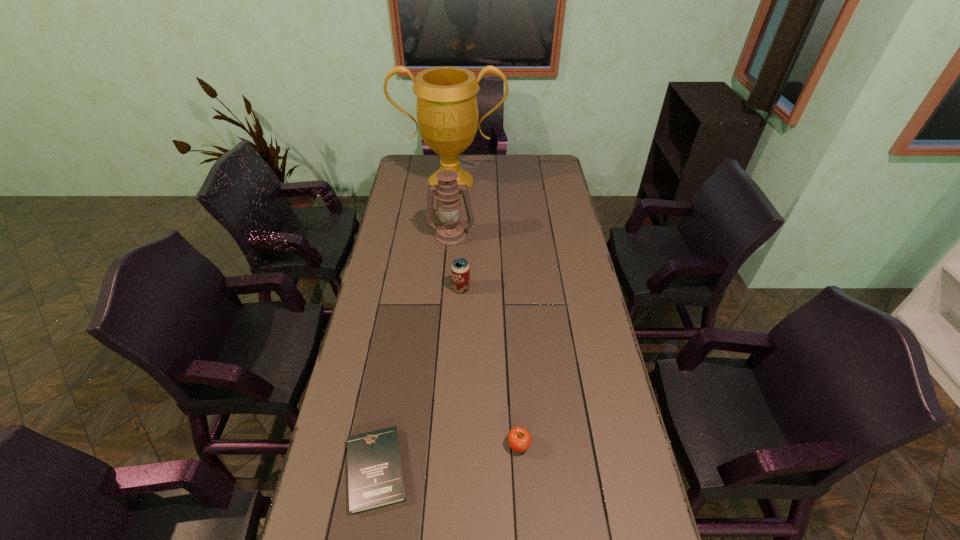
Where is `free spot between the apple and the fourth shortest object`? The width and height of the screenshot is (960, 540). free spot between the apple and the fourth shortest object is located at coordinates [485, 340].

What are the coordinates of `free space between the apple and the third tallest object` in the screenshot? It's located at (490, 367).

The height and width of the screenshot is (540, 960). In order to click on blank region between the fourth nearest object and the apple in this screenshot , I will do `click(485, 340)`.

Locate an element on the screen. This screenshot has width=960, height=540. free space between the second shortest object and the trophy is located at coordinates (485, 313).

The height and width of the screenshot is (540, 960). I want to click on free point between the beer can and the fourth tallest object, so click(490, 367).

I want to click on vacant point located between the shortest object and the tallest object, so click(x=414, y=326).

The image size is (960, 540). What are the coordinates of `free spot between the fourth tallest object and the shortest object` in the screenshot? It's located at (447, 457).

The image size is (960, 540). In order to click on vacant area that lies between the shortest object and the trophy in this screenshot , I will do `click(414, 326)`.

Where is `object that is the second closest to the third tallest object`? Image resolution: width=960 pixels, height=540 pixels. object that is the second closest to the third tallest object is located at coordinates (375, 477).

Identify which object is the fourth nearest to the apple. Please provide its 2D coordinates. Your answer should be formatted as a tuple, i.e. [(x, y)], where the tuple contains the x and y coordinates of a point satisfying the conditions above.

[(447, 114)]